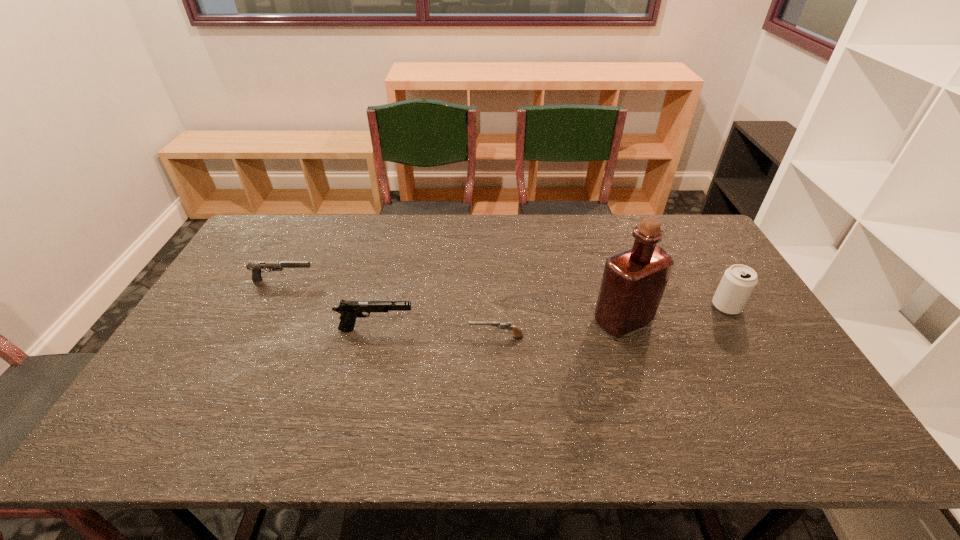
Where is `the tallest object`? the tallest object is located at coordinates (633, 282).

At what (x,y) coordinates should I click in order to perform the action: click on the fourth object from left to right. Please return your answer as a coordinate pair (x, y). The image size is (960, 540). Looking at the image, I should click on (633, 282).

The width and height of the screenshot is (960, 540). What are the coordinates of `the fourth shortest object` in the screenshot? It's located at (739, 281).

Find the location of a particular element. The width and height of the screenshot is (960, 540). can is located at coordinates (739, 281).

Where is `the second object from left to right`? This screenshot has width=960, height=540. the second object from left to right is located at coordinates (350, 310).

Identify the location of the second gun from left to right. (350, 310).

What are the coordinates of `the fourth tallest object` in the screenshot? It's located at (255, 267).

Locate an element on the screen. The image size is (960, 540). the leftmost gun is located at coordinates (255, 267).

This screenshot has height=540, width=960. I want to click on the third object from left to right, so click(507, 325).

Where is `the rightmost gun`? The image size is (960, 540). the rightmost gun is located at coordinates (507, 325).